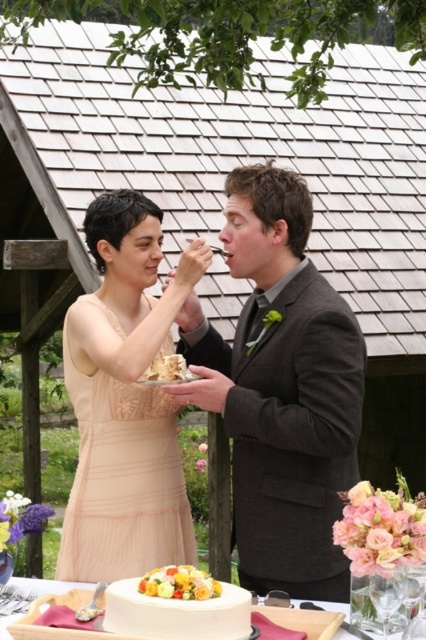
Describe the element at coordinates (178, 582) in the screenshot. I see `yellow flower bouquet at center` at that location.

Which is in front, point (166, 576) or point (43, 586)?

Point (166, 576)

At what (x,y) coordinates should I click in order to perform the action: click on yellow flower bouquet at center. Please return your answer as a coordinate pair (x, y). The width and height of the screenshot is (426, 640). Looking at the image, I should click on (178, 582).

How much distance is there between pale pink satin dress at center and white creamy cake at upper center?

17.53 inches

Does point (80, 440) come farther from viewer compared to point (169, 374)?

Yes, point (80, 440) is behind point (169, 374).

The height and width of the screenshot is (640, 426). Identify the location of pale pink satin dress at center. (121, 476).

Can you confirm if pale pink satin dress at center is bigger than white fondant cake at center?

Indeed, pale pink satin dress at center has a larger size compared to white fondant cake at center.

Based on the photo, who is more distant from viewer, (138, 404) or (118, 632)?

The point (138, 404) is behind.

Is point (114, 570) closer to viewer compared to point (203, 577)?

No, it is not.

Find the location of a particular element. Image resolution: width=426 pixels, height=640 pixels. pale pink satin dress at center is located at coordinates (121, 476).